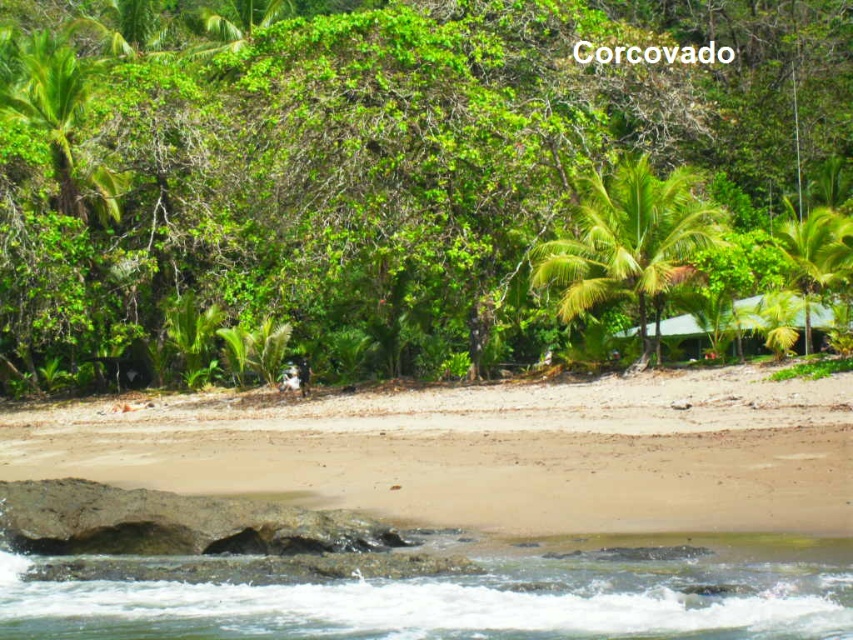
Question: Can you confirm if green leafy palm tree at center is smaller than green leafy palm tree at right?

Choices:
 (A) no
 (B) yes

Answer: (A)

Question: Where is green leafy trees at upper center located in relation to beige sandy beach at lower center in the image?

Choices:
 (A) left
 (B) right

Answer: (A)

Question: Which point is farther to the camera?

Choices:
 (A) (358, 589)
 (B) (698, 212)
 (C) (387, 324)

Answer: (C)

Question: Estimate the real-world distances between objects in this image. Which object is closer to the clear water at lower center?

Choices:
 (A) green leafy palm tree at right
 (B) green leafy palm tree at center
 (C) green leafy trees at upper center

Answer: (B)

Question: Considering the relative positions of beige sandy beach at lower center and green leafy palm tree at center in the image provided, where is beige sandy beach at lower center located with respect to green leafy palm tree at center?

Choices:
 (A) below
 (B) above

Answer: (A)

Question: Among these points, which one is nearest to the camera?

Choices:
 (A) (836, 211)
 (B) (753, 528)
 (C) (752, 536)

Answer: (C)